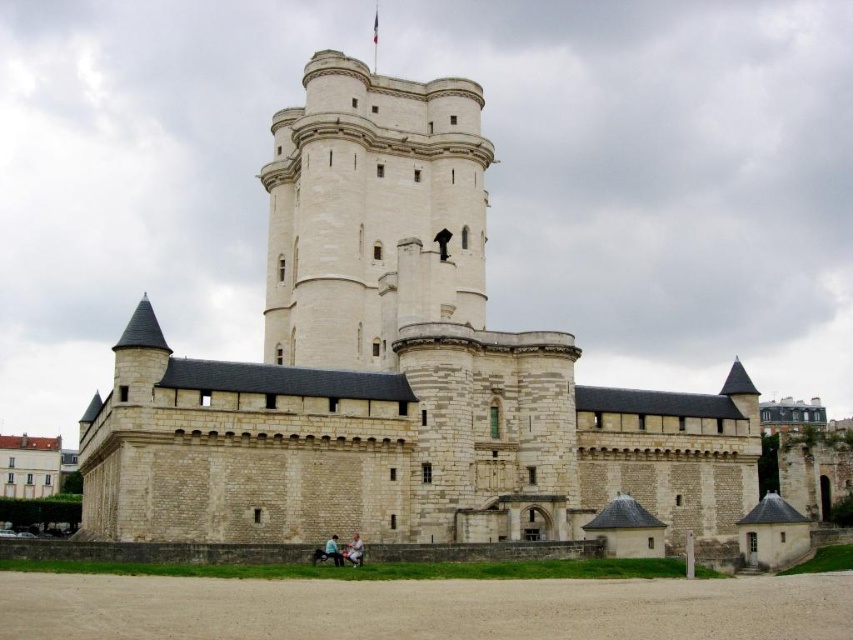
You are a medieval architect examining the grand medieval castle. You notice the white stone castle at center and the white stone tower at center. Which structure would require more building materials to construct?

The white stone castle at center has a larger size compared to the white stone tower at center, so it would require more building materials to construct.

Imagine you are standing in front of the medieval castle. There are two points marked on the castle walls at coordinates point (296, 472) and point (334, 52). Which point is nearer to your current position?

Point (296, 472) is closer to the camera than point (334, 52), so the point nearer to your position is point (296, 472).

You are standing at the entrance of the grand medieval castle and see the point marked at coordinates (x=369, y=209). What does this point indicate in the scene?

The point at coordinates (x=369, y=209) corresponds to the white stone tower at center, which is the central feature of the castle with its tall, cylindrical structure and defensive crenellations.